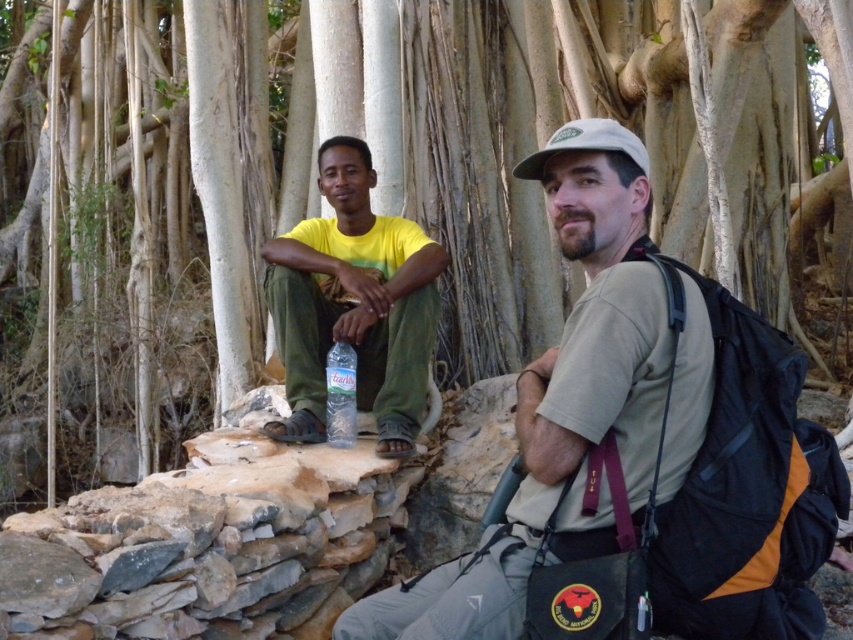
Which is more to the right, matte khaki t-shirt at center or clear plastic bottle at center?

From the viewer's perspective, matte khaki t-shirt at center appears more on the right side.

Is point (613, 269) farther from viewer compared to point (352, 356)?

That is False.

I want to click on matte khaki t-shirt at center, so click(x=560, y=396).

The image size is (853, 640). Find the location of `matte khaki t-shirt at center`. matte khaki t-shirt at center is located at coordinates (560, 396).

Who is more forward, (654,356) or (337,320)?

Point (654,356) is in front.

Identify the location of matte khaki t-shirt at center. Image resolution: width=853 pixels, height=640 pixels. (560, 396).

Find the location of a particular element. matte khaki t-shirt at center is located at coordinates (560, 396).

Can you confirm if yellow t-shirt at center is smaller than clear plastic bottle at center?

No.

Can you confirm if yellow t-shirt at center is taller than clear plastic bottle at center?

Correct, yellow t-shirt at center is much taller as clear plastic bottle at center.

This screenshot has height=640, width=853. In order to click on yellow t-shirt at center in this screenshot , I will do `click(352, 305)`.